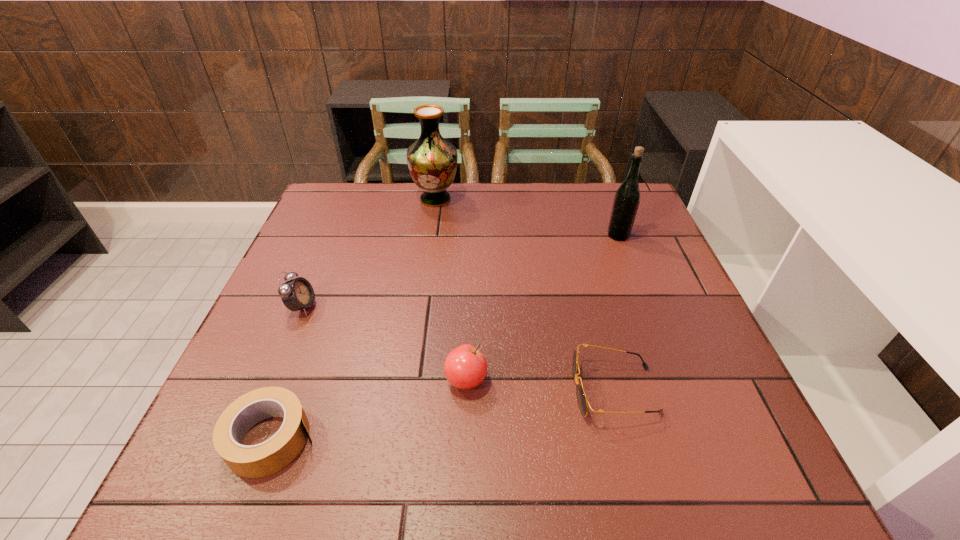
Locate an element on the screen. The image size is (960, 540). empty location between the fourth tallest object and the sunglasses is located at coordinates (540, 385).

At what (x,y) coordinates should I click in order to perform the action: click on vacant area that lies between the duct tape and the second farthest object. Please return your answer as a coordinate pair (x, y). Looking at the image, I should click on (444, 337).

At what (x,y) coordinates should I click in order to perform the action: click on empty space between the fourth tallest object and the fifth object from left to right. Please return your answer as a coordinate pair (x, y). The height and width of the screenshot is (540, 960). Looking at the image, I should click on (540, 385).

Locate an element on the screen. Image resolution: width=960 pixels, height=540 pixels. vacant point located between the duct tape and the alarm clock is located at coordinates point(287,373).

The height and width of the screenshot is (540, 960). What are the coordinates of `object that stands as the closest to the rightmost object` in the screenshot? It's located at (582, 400).

In order to click on object that ranks as the closest to the duct tape in this screenshot , I will do `click(296, 294)`.

This screenshot has height=540, width=960. I want to click on free space that satisfies the following two spatial constraints: 1. on the front side of the rightmost object; 2. on the front-facing side of the fifth object from left to right, so click(678, 390).

This screenshot has width=960, height=540. Identify the location of vacant region that satisfies the following two spatial constraints: 1. on the front side of the beer bottle; 2. on the face of the alarm clock. click(x=646, y=307).

I want to click on vacant space that satisfies the following two spatial constraints: 1. on the front side of the second farthest object; 2. at the edge of the duct tape, so click(x=697, y=438).

Locate an element on the screen. This screenshot has width=960, height=540. free point that satisfies the following two spatial constraints: 1. on the face of the apple; 2. on the left side of the third tallest object is located at coordinates (272, 380).